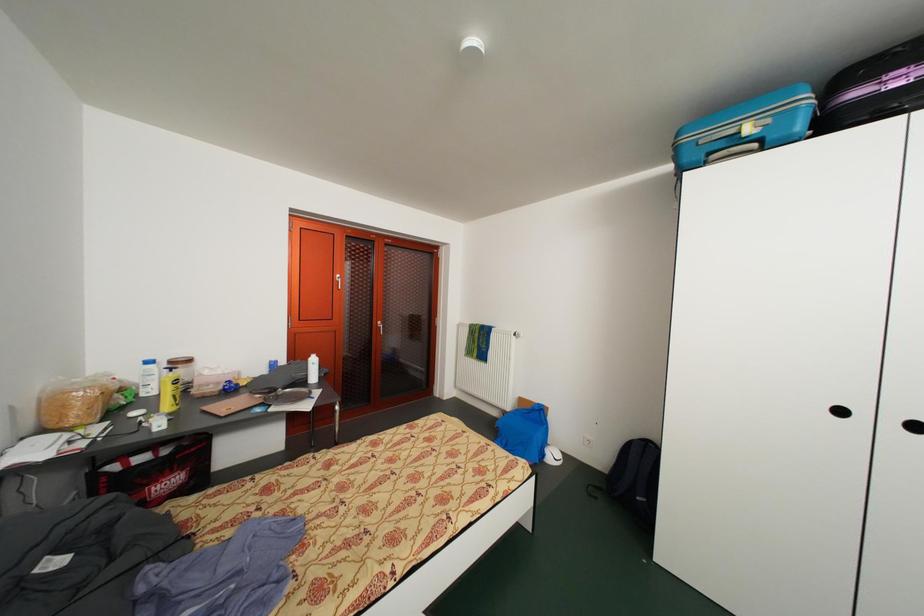
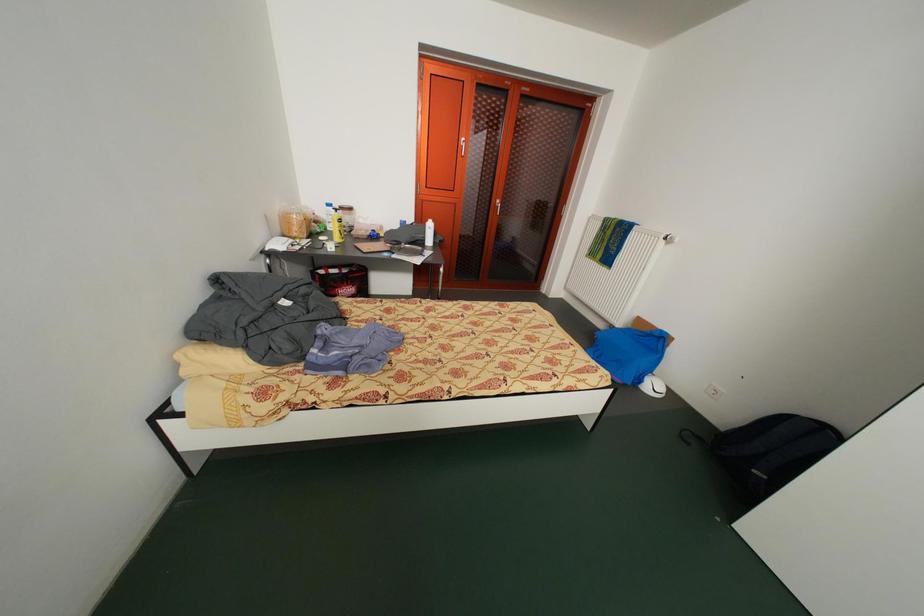
First-person continuous shooting, in which direction is the camera rotating?

The camera's rotation is toward left-down.